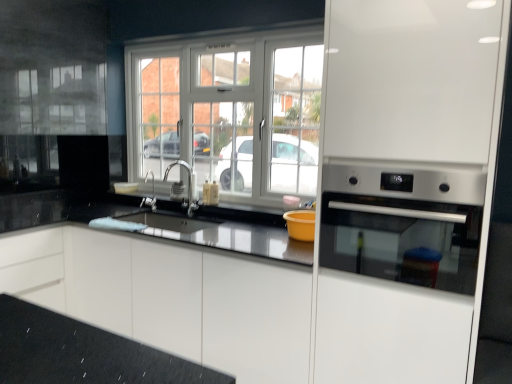
This screenshot has width=512, height=384. I want to click on satin nickel faucet at center, so click(188, 184).

The width and height of the screenshot is (512, 384). Describe the element at coordinates (188, 184) in the screenshot. I see `satin nickel faucet at center` at that location.

What do you see at coordinates (152, 194) in the screenshot? I see `satin nickel faucet at center` at bounding box center [152, 194].

Image resolution: width=512 pixels, height=384 pixels. I want to click on satin silver oven at right, so click(x=403, y=224).

Describe the element at coordinates (406, 168) in the screenshot. I see `stainless steel oven at right` at that location.

Where is `white plastic window at center`? Image resolution: width=512 pixels, height=384 pixels. white plastic window at center is located at coordinates (230, 112).

Identify the location of satin nickel faucet at center. This screenshot has width=512, height=384. (188, 184).

How different are the orientations of stainless steel oven at right and satin nickel faucet at center in degrees?

stainless steel oven at right and satin nickel faucet at center are facing 2.19 degrees away from each other.

The image size is (512, 384). Find the location of `appliance on the right of satin nickel faucet at center`. appliance on the right of satin nickel faucet at center is located at coordinates (406, 168).

From the image's perspective, is stainless steel oven at right on top of satin nickel faucet at center?

Actually, stainless steel oven at right appears below satin nickel faucet at center in the image.

From a real-world perspective, is stainless steel oven at right above or below satin nickel faucet at center?

stainless steel oven at right is situated higher than satin nickel faucet at center in the real world.

From the image's perspective, who appears lower, satin nickel faucet at center or satin silver oven at right?

satin silver oven at right appears lower in the image.

This screenshot has width=512, height=384. I want to click on home appliance above the satin nickel faucet at center (from a real-world perspective), so click(x=403, y=224).

Is satin nickel faucet at center to the left of satin silver oven at right from the viewer's perspective?

Yes.

Is point (153, 188) behind point (428, 270)?

Yes, it is.

Based on their sizes in the image, would you say satin nickel faucet at center is bigger or smaller than white glossy cabinet at center?

In the image, satin nickel faucet at center appears to be smaller than white glossy cabinet at center.

Is point (145, 204) farther from camera compared to point (33, 262)?

Yes, it is.

Considering the positions of objects satin nickel faucet at center and white glossy cabinet at center in the image provided, who is more to the left, satin nickel faucet at center or white glossy cabinet at center?

From the viewer's perspective, satin nickel faucet at center appears more on the left side.

Which of these two, satin nickel faucet at center or white glossy cabinet at center, is wider?

white glossy cabinet at center.

Would you say satin silver oven at right is inside or outside stainless steel oven at right?

satin silver oven at right is enclosed within stainless steel oven at right.

Looking at this image, between satin silver oven at right and stainless steel oven at right, which one has less height?

satin silver oven at right.

Based on the photo, between satin silver oven at right and stainless steel oven at right, which one has smaller size?

With smaller size is satin silver oven at right.

Is satin nickel faucet at center not within white plastic window at center?

That's correct, satin nickel faucet at center is outside of white plastic window at center.

Considering the sizes of satin nickel faucet at center and white plastic window at center in the image, is satin nickel faucet at center taller or shorter than white plastic window at center?

In the image, satin nickel faucet at center appears to be shorter than white plastic window at center.

From a real-world perspective, which object rests below the other?

From a 3D spatial view, satin nickel faucet at center is below.

Which object is thinner, satin nickel faucet at center or white plastic window at center?

white plastic window at center.

From the image's perspective, is satin silver oven at right located above or below white glossy cabinet at center?

From the image's perspective, satin silver oven at right appears above white glossy cabinet at center.

Does point (325, 261) lie behind point (116, 250)?

No, (325, 261) is closer to viewer.

Based on the photo, is satin silver oven at right facing away from white glossy cabinet at center?

That's not correct — satin silver oven at right is not looking away from white glossy cabinet at center.

Consider the image. Can you confirm if satin silver oven at right is positioned to the left of white glossy cabinet at center?

Incorrect, satin silver oven at right is not on the left side of white glossy cabinet at center.

Is white plastic window at center completely or partially inside satin silver oven at right?

No, white plastic window at center is not surrounded by satin silver oven at right.

From a real-world perspective, which is physically above, satin silver oven at right or white plastic window at center?

In real-world perspective, white plastic window at center is above.

Considering the positions of point (326, 242) and point (173, 90), is point (326, 242) closer or farther from the camera than point (173, 90)?

Point (326, 242).

This screenshot has height=384, width=512. I want to click on window above the satin silver oven at right (from the image's perspective), so click(230, 112).

This screenshot has width=512, height=384. I want to click on appliance lying in front of the satin nickel faucet at center, so click(x=406, y=168).

Find the location of `faucet below the satin silver oven at right (from a real-world perspective)`. faucet below the satin silver oven at right (from a real-world perspective) is located at coordinates (152, 194).

Considering their positions, is white glossy cabinet at center positioned further to satin nickel faucet at center than satin nickel faucet at center?

white glossy cabinet at center.

From the image, which object appears to be nearer to white plastic window at center, white glossy cabinet at center or stainless steel oven at right?

Among the two, white glossy cabinet at center is located nearer to white plastic window at center.

From the image, which object appears to be nearer to satin nickel faucet at center, white plastic window at center or stainless steel oven at right?

white plastic window at center is closer to satin nickel faucet at center.

In the scene shown: Considering their positions, is stainless steel oven at right positioned further to satin silver oven at right than white plastic window at center?

The object further to satin silver oven at right is white plastic window at center.

Considering their positions, is stainless steel oven at right positioned further to satin nickel faucet at center than white glossy cabinet at center?

stainless steel oven at right is positioned further to the anchor satin nickel faucet at center.

From the image, which object appears to be nearer to white plastic window at center, satin nickel faucet at center or white glossy cabinet at center?

satin nickel faucet at center lies closer to white plastic window at center than the other object.

Considering their positions, is white plastic window at center positioned closer to satin nickel faucet at center than satin nickel faucet at center?

satin nickel faucet at center is positioned closer to the anchor satin nickel faucet at center.

Which object lies further to the anchor point satin nickel faucet at center, satin silver oven at right or white plastic window at center?

The object further to satin nickel faucet at center is satin silver oven at right.

Identify the location of tap positioned between stainless steel oven at right and satin nickel faucet at center from near to far. The image size is (512, 384). tap(188, 184).

What are the coordinates of `home appliance located between stainless steel oven at right and white plastic window at center in the depth direction` in the screenshot? It's located at (403, 224).

Where is `window between satin silver oven at right and satin nickel faucet at center from front to back`? window between satin silver oven at right and satin nickel faucet at center from front to back is located at coordinates (230, 112).

Image resolution: width=512 pixels, height=384 pixels. I want to click on tap between satin nickel faucet at center and satin silver oven at right from left to right, so click(x=188, y=184).